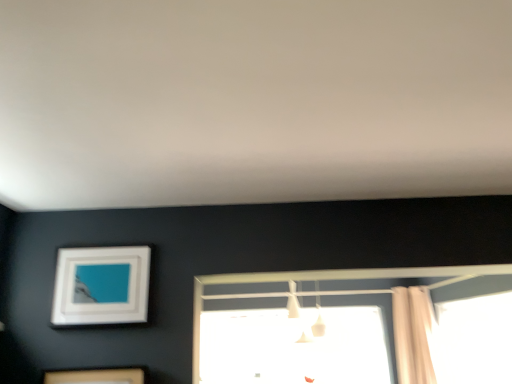
Question: From the image's perspective, would you say white matte light fixture at center is positioned over white glossy picture frame at upper left?

Choices:
 (A) yes
 (B) no

Answer: (B)

Question: Is white matte light fixture at center further to camera compared to white glossy picture frame at upper left?

Choices:
 (A) yes
 (B) no

Answer: (A)

Question: Is white glossy picture frame at upper left inside white matte light fixture at center?

Choices:
 (A) no
 (B) yes

Answer: (A)

Question: Considering the relative sizes of white matte light fixture at center and white glossy picture frame at upper left in the image provided, is white matte light fixture at center bigger than white glossy picture frame at upper left?

Choices:
 (A) yes
 (B) no

Answer: (A)

Question: Does white matte light fixture at center have a smaller size compared to white glossy picture frame at upper left?

Choices:
 (A) no
 (B) yes

Answer: (A)

Question: Considering their positions, is beige fabric shower curtain at right located in front of or behind white matte light fixture at center?

Choices:
 (A) front
 (B) behind

Answer: (B)

Question: Considering the positions of beige fabric shower curtain at right and white matte light fixture at center in the image, is beige fabric shower curtain at right taller or shorter than white matte light fixture at center?

Choices:
 (A) tall
 (B) short

Answer: (A)

Question: Is beige fabric shower curtain at right wider or thinner than white matte light fixture at center?

Choices:
 (A) thin
 (B) wide

Answer: (A)

Question: Looking at the image, does beige fabric shower curtain at right seem bigger or smaller compared to white matte light fixture at center?

Choices:
 (A) big
 (B) small

Answer: (A)

Question: Is transparent glass window at center, positioned as the second window in back-to-front order, situated inside beige fabric shower curtain at right or outside?

Choices:
 (A) inside
 (B) outside

Answer: (B)

Question: Considering the relative positions of transparent glass window at center, positioned as the first window in front-to-back order, and beige fabric shower curtain at right in the image provided, is transparent glass window at center, positioned as the first window in front-to-back order, to the left or to the right of beige fabric shower curtain at right?

Choices:
 (A) right
 (B) left

Answer: (A)

Question: From the image's perspective, is transparent glass window at center, the 1th window in the right-to-left sequence, positioned above or below beige fabric shower curtain at right?

Choices:
 (A) below
 (B) above

Answer: (A)

Question: From their relative heights in the image, would you say transparent glass window at center, positioned as the second window in back-to-front order, is taller or shorter than beige fabric shower curtain at right?

Choices:
 (A) tall
 (B) short

Answer: (B)

Question: From a real-world perspective, is white glossy picture frame at upper left physically located above or below transparent glass window at center, which is the second window from right to left?

Choices:
 (A) above
 (B) below

Answer: (A)

Question: Is white glossy picture frame at upper left in front of or behind transparent glass window at center, the 1th window viewed from the left, in the image?

Choices:
 (A) behind
 (B) front

Answer: (B)